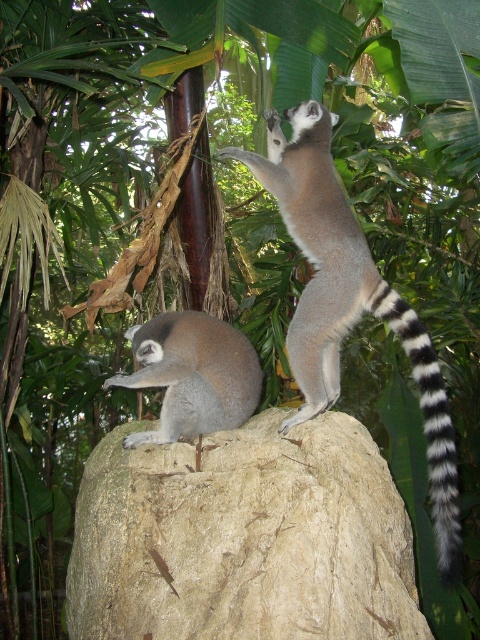
Can you confirm if ring-tailed lemur at center is positioned below soft gray fur lemur at center?

Actually, ring-tailed lemur at center is above soft gray fur lemur at center.

Which is in front, point (335, 268) or point (182, 355)?

Point (182, 355) is more forward.

Between point (311, 216) and point (252, 406), which one is positioned in front?

Point (311, 216)

Find the location of a particular element. This screenshot has width=480, height=640. ring-tailed lemur at center is located at coordinates (348, 300).

Is rough textured rock at center thinner than ring-tailed lemur at center?

In fact, rough textured rock at center might be wider than ring-tailed lemur at center.

Between rough textured rock at center and ring-tailed lemur at center, which one is positioned lower?

rough textured rock at center is lower down.

The image size is (480, 640). Find the location of `rough textured rock at center`. rough textured rock at center is located at coordinates (242, 538).

How distant is soft gray fur lemur at center from black and white striped tail at upper right?

A distance of 24.61 inches exists between soft gray fur lemur at center and black and white striped tail at upper right.

Which is more to the right, soft gray fur lemur at center or black and white striped tail at upper right?

black and white striped tail at upper right is more to the right.

Who is more distant from viewer, [163,380] or [372,314]?

Positioned behind is point [372,314].

At what (x,y) coordinates should I click in order to perform the action: click on soft gray fur lemur at center. Please return your answer as a coordinate pair (x, y). This screenshot has width=480, height=640. Looking at the image, I should click on (192, 374).